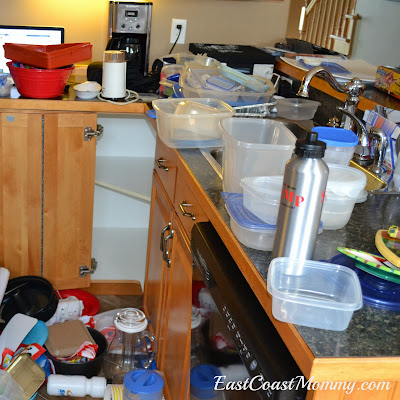
The width and height of the screenshot is (400, 400). Find the location of `wall`. wall is located at coordinates (231, 18).